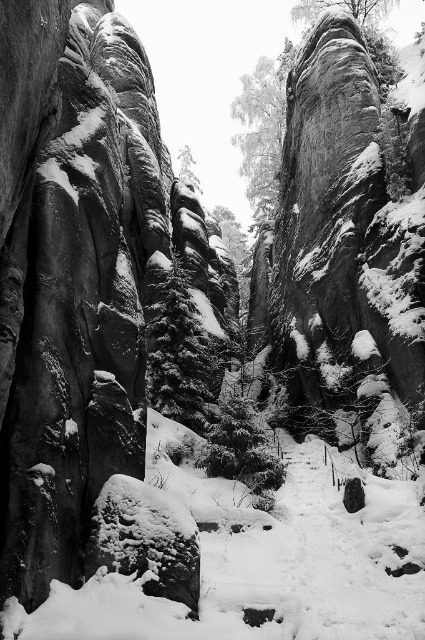
Question: Which point is farther to the camera?

Choices:
 (A) green textured pine at center
 (B) green textured evergreen tree at center
 (C) smooth gray rock at upper center

Answer: (A)

Question: Which of the following is the closest to the observer?

Choices:
 (A) green textured pine at center
 (B) green textured evergreen tree at center

Answer: (B)

Question: Is green textured evergreen tree at center to the right of green textured pine at center from the viewer's perspective?

Choices:
 (A) no
 (B) yes

Answer: (B)

Question: Which of the following is the closest to the observer?

Choices:
 (A) (251, 198)
 (B) (181, 308)

Answer: (B)

Question: Is green textured evergreen tree at center above green textured pine at center?

Choices:
 (A) no
 (B) yes

Answer: (A)

Question: Can you confirm if smooth gray rock at upper center is positioned below green textured evergreen tree at center?

Choices:
 (A) yes
 (B) no

Answer: (B)